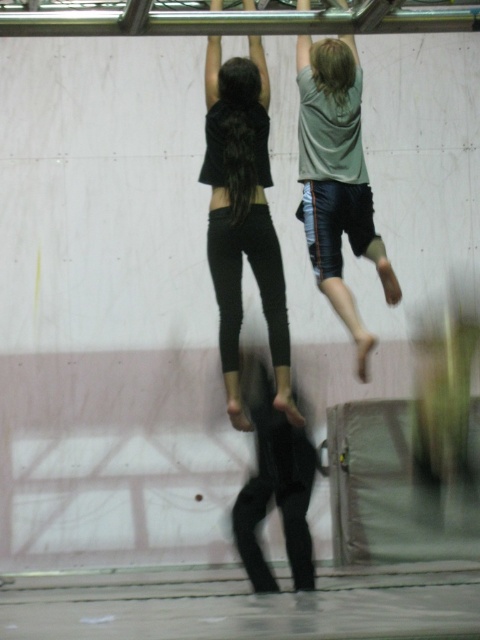
You are a photographer positioned at the entrance of the gymnasium. You need to capture a photo where both the light gray cotton shirt at upper right and the black matte pants at center are visible in the frame. Based on their positions, which direction should you move to ensure both are in your shot?

The light gray cotton shirt at upper right is to the right of the black matte pants at center. To include both in the frame, you should move to the left so that the black matte pants at center remains centered and the light gray cotton shirt at upper right stays within the right side of the frame.

Based on the photo, you are a photographer positioned at the front of the gymnasium. You want to take a photo that includes both the black matte leggings at center and the light gray cotton shirt at upper right. Which object should you adjust your focus to ensure it appears clearer in the photo?

The black matte leggings at center is closer to the viewer than the light gray cotton shirt at upper right. To ensure clarity, focus on the black matte leggings at center since it is nearer and will be in focus first.

You are standing at the point with coordinates (333, 113) in the gymnasium. What object is located at this point?

The point at (333, 113) corresponds to the light gray cotton shirt at upper right.